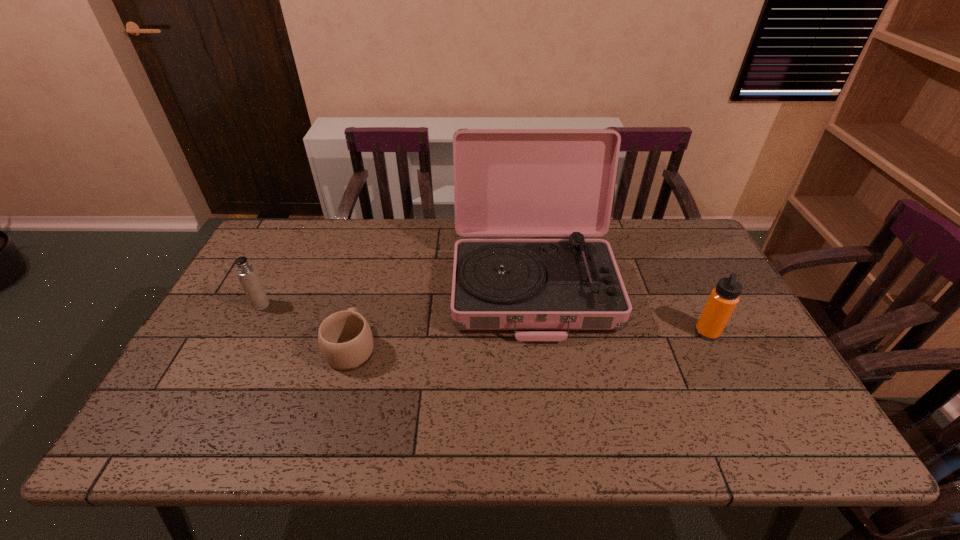
Locate an element on the screen. This screenshot has width=960, height=540. vacant space at the far left corner of the desktop is located at coordinates (263, 243).

The width and height of the screenshot is (960, 540). I want to click on vacant area at the far right corner of the desktop, so click(680, 257).

Image resolution: width=960 pixels, height=540 pixels. Find the location of `vacant area that lies between the shortest object and the third object from left to right`. vacant area that lies between the shortest object and the third object from left to right is located at coordinates (442, 316).

Locate which object is the third closest to the third object from left to right. Please provide its 2D coordinates. Your answer should be formatted as a tuple, i.e. [(x, y)], where the tuple contains the x and y coordinates of a point satisfying the conditions above.

[(245, 271)]

Locate an element on the screen. This screenshot has width=960, height=540. object that is the third closest to the leftmost object is located at coordinates (724, 298).

Locate an element on the screen. free space that satisfies the following two spatial constraints: 1. on the side of the rightmost object with the handle; 2. on the left side of the mug is located at coordinates (356, 332).

Identify the location of vacant space that satisfies the following two spatial constraints: 1. on the side of the nearer thermos bottle with the handle; 2. on the left side of the mug. (356, 332).

This screenshot has height=540, width=960. Identify the location of free space that satisfies the following two spatial constraints: 1. with the lid open on the nearer thermos bottle; 2. on the right side of the second object from right to left. (539, 332).